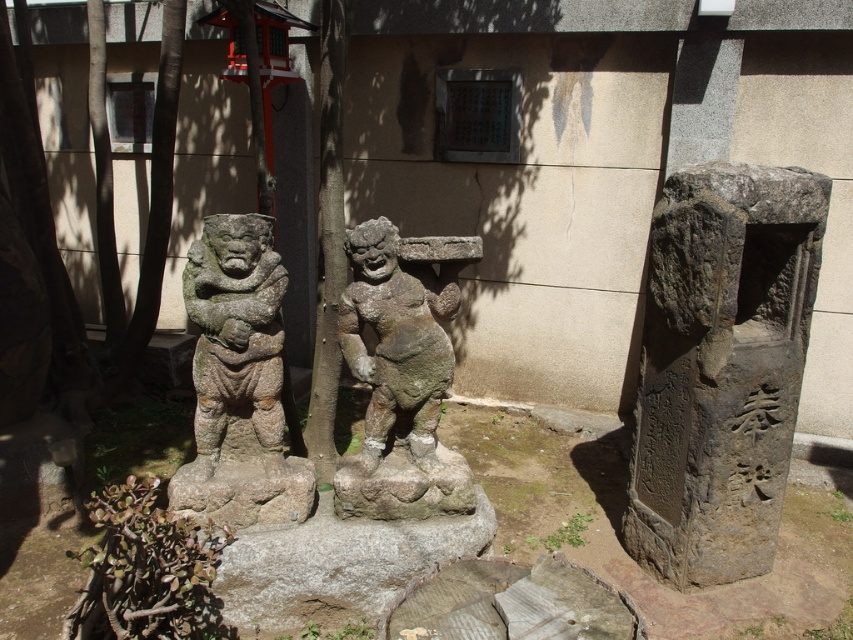
Based on the photo, you are a visitor approaching the beige wall with two stone structures. You see the gray stone pillar at right and the gray stone statue at center. Which one is positioned lower in relation to the ground?

The gray stone pillar at right is located below the gray stone statue at center, so it is positioned lower in relation to the ground.

You are standing in front of the beige wall and notice the gray stone pillar at right. Can you determine its exact position relative to the wall based on the coordinates provided?

The gray stone pillar at right is located at point coordinates (721, 368) relative to the wall.